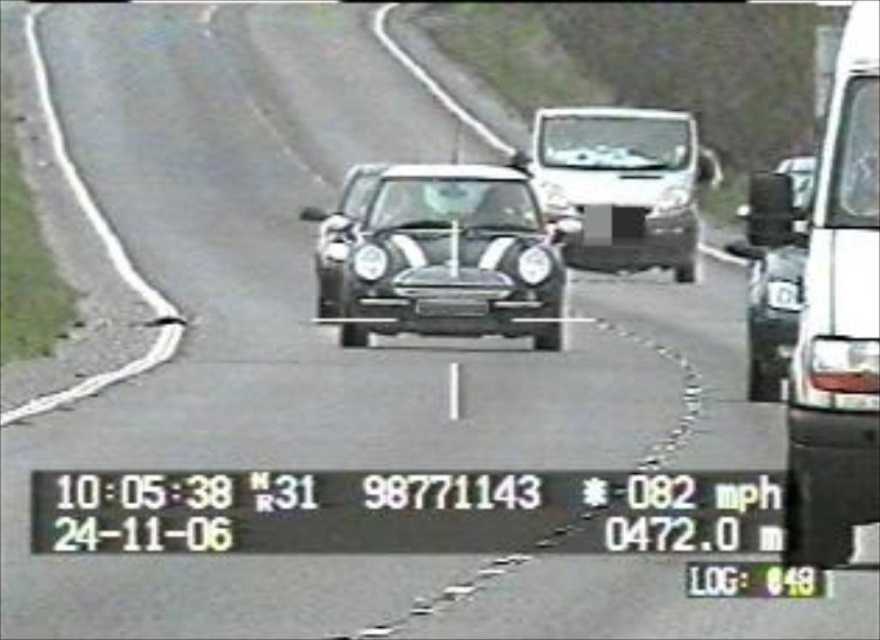
Question: Does white matte van at right appear on the left side of white glossy truck at right?

Choices:
 (A) no
 (B) yes

Answer: (B)

Question: Where is glossy black car at center located in relation to white glossy truck at right in the image?

Choices:
 (A) left
 (B) right

Answer: (A)

Question: Among these objects, which one is farthest from the camera?

Choices:
 (A) white matte van at right
 (B) glossy black car at center

Answer: (B)

Question: Among these points, which one is farthest from the camera?

Choices:
 (A) (818, 529)
 (B) (776, 301)
 (C) (794, 340)
 (D) (660, 109)

Answer: (D)

Question: Considering the real-world distances, which object is closest to the black plastic license plate at center?

Choices:
 (A) white matte van at right
 (B) glossy black car at center
 (C) white glossy truck at right
 (D) white glossy van at center

Answer: (C)

Question: Is glossy black car at center wider than black plastic license plate at center?

Choices:
 (A) yes
 (B) no

Answer: (A)